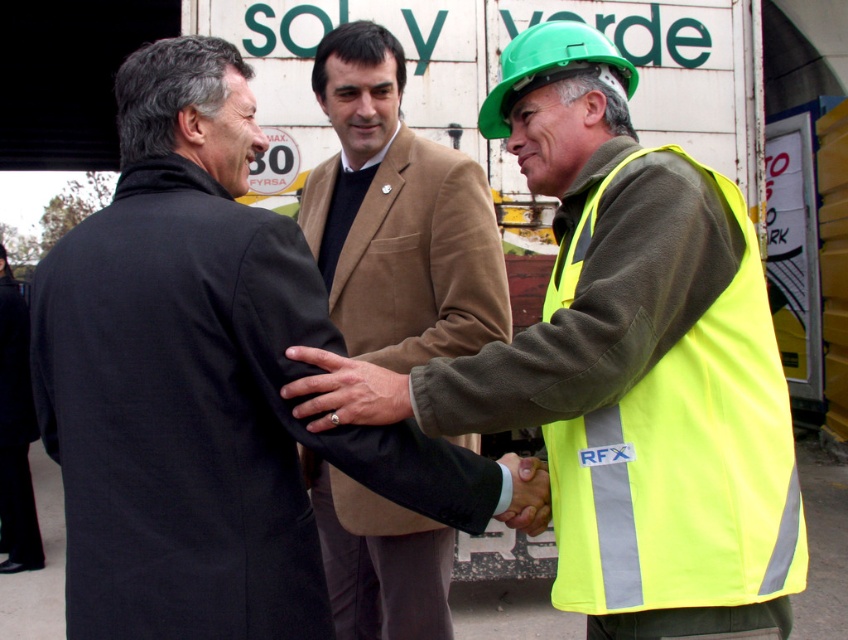
You are a photographer trying to capture a closeup of the neon yellow safety vest at center and the brown woolen suit at center. Since you can only focus on one object at a time, which one should you choose to ensure it fills the frame more?

The neon yellow safety vest at center is bigger than the brown woolen suit at center, so you should focus on the neon yellow safety vest at center to ensure it fills the frame more.

Consider the image. You are a photographer standing at the camera position. You want to focus on the point closer to you between the two points labeled as point (640, 628) and point (324, 422). Which point should you choose?

You should choose point (640, 628) because it is closer to the camera than point (324, 422).

You are standing at the point labeled as point (354, 627) in the image. You want to move to the container with the text SOL y verde. Is the container with the text SOL y verde within your line of sight?

The point (354, 627) is 3.58 meters away from the viewer. Since the container with the text SOL y verde is in the background, it is likely within the line of sight unless there are obstructions. However, the description does not mention any obstructions, so the container with the text SOL y verde should be visible.